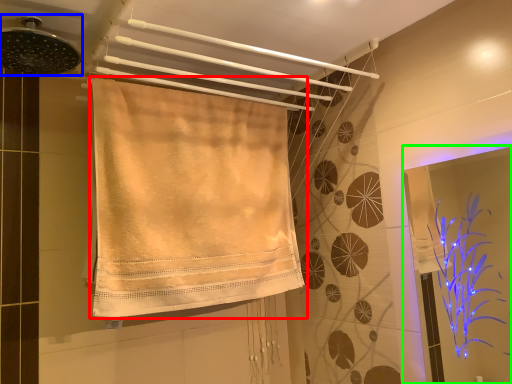
Question: Which object is the closest to the towel (highlighted by a red box)? Choose among these: shower (highlighted by a blue box) or screen door (highlighted by a green box).

Choices:
 (A) shower
 (B) screen door

Answer: (A)